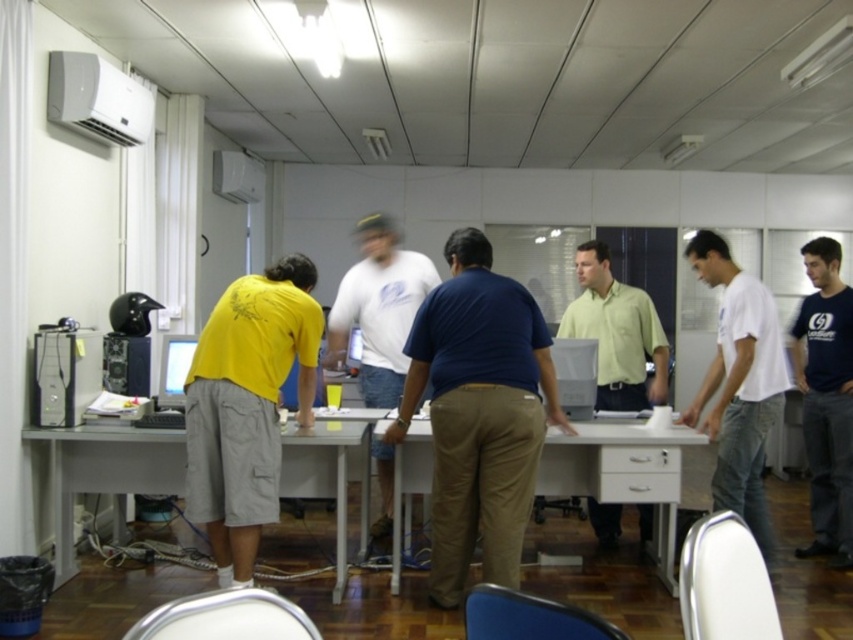
Who is more forward, [279,376] or [338,518]?

Point [279,376] is in front.

Is yellow matte shirt at left taller than white plastic table at lower left?

Yes, yellow matte shirt at left is taller than white plastic table at lower left.

Looking at this image, who is more forward, (224, 442) or (73, 486)?

Point (224, 442) is more forward.

Locate an element on the screen. The width and height of the screenshot is (853, 640). yellow matte shirt at left is located at coordinates (247, 406).

Is point (610, 300) positioned before point (592, 401)?

That is False.

Does light green shirt at center have a lesser width compared to satin silver monitor at center?

No.

The width and height of the screenshot is (853, 640). What are the coordinates of `light green shirt at center` in the screenshot? It's located at (618, 332).

Can you confirm if matte blue shirt at center is wider than light green shirt at center?

Correct, the width of matte blue shirt at center exceeds that of light green shirt at center.

Based on the photo, between matte blue shirt at center and light green shirt at center, which one is positioned lower?

matte blue shirt at center is below.

Does point (515, 323) come closer to viewer compared to point (608, 333)?

That is True.

Locate an element on the screen. matte blue shirt at center is located at coordinates (479, 412).